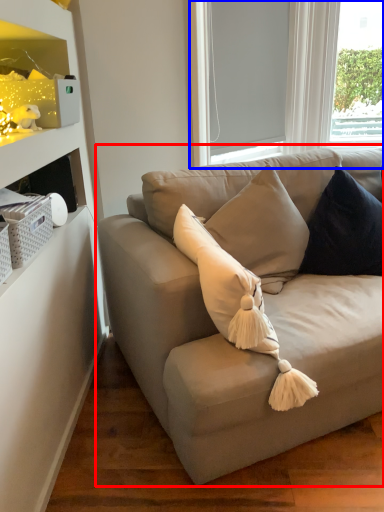
Question: Which object is further to the camera taking this photo, studio couch (highlighted by a red box) or bay window (highlighted by a blue box)?

Choices:
 (A) studio couch
 (B) bay window

Answer: (B)